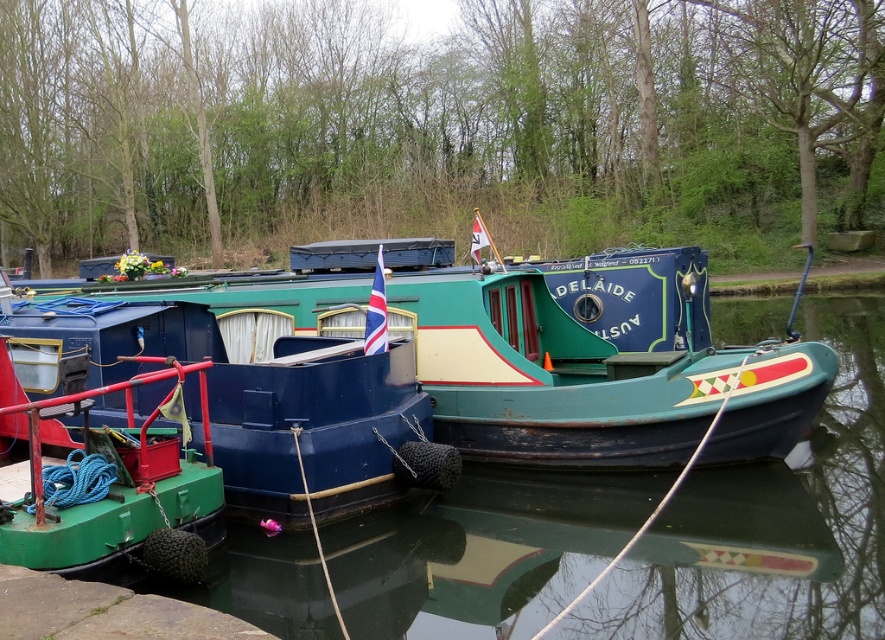
You are standing on the dock and see the teal wooden boat at center and the green matte boat at left. Which boat is positioned higher relative to the other?

The teal wooden boat at center is located above the green matte boat at left, so it is positioned higher.

You are standing at the origin point of the coordinate system where the bottom left corner is the origin. The image has a width of 1 unit and height of 1 unit. Where is the matte blue boat at center located in terms of coordinates?

The matte blue boat at center is located at point coordinates of (259, 400).

You are a delivery person needing to unload a large crate that requires a minimum of 3 meters of space. You see the teal wooden boat at center and the brown stone dock at lower left. Which location has enough space to accommodate the crate?

The teal wooden boat at center has a larger width than the brown stone dock at lower left, so it can accommodate the large crate requiring at least 3 meters of space.